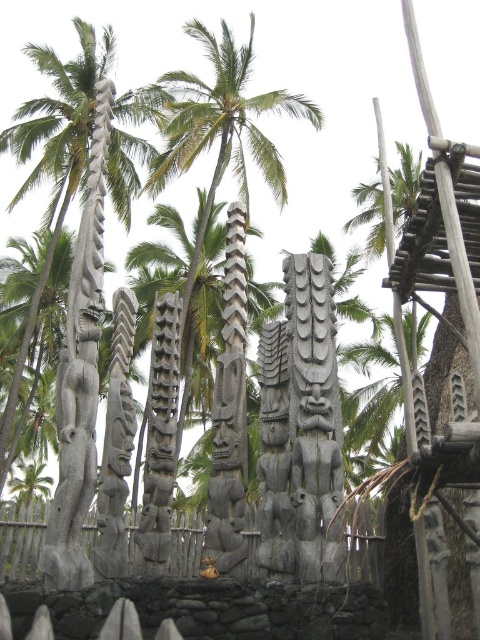
You are a visitor at this cultural site and want to take a photo of both the dark gray wood totem pole at center and the dark gray stone totem pole at center. Which one should you position to your left to include both in the frame?

You should position the dark gray stone totem pole at center to your left because the dark gray wood totem pole at center is on its right side, so arranging them this way will allow both to be captured in the photo.

Looking at this image, you are an archaeologist examining the statues and their placement. Based on the coordinates given, can you identify what the point at (159, 435) corresponds to?

The point at (159, 435) corresponds to the dark gray wood totem pole at center.